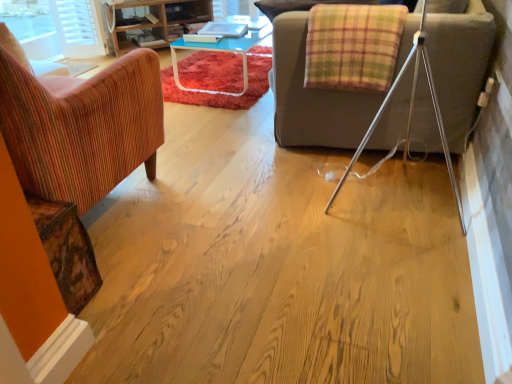
In order to click on wooden shelves at upper left in this screenshot , I will do `click(156, 22)`.

Find the location of a particular element. The height and width of the screenshot is (384, 512). plaid fabric blanket at upper right is located at coordinates (353, 46).

Are plaid fabric blanket at upper right and wooden textured armchair at left beside each other?

No, plaid fabric blanket at upper right is not in contact with wooden textured armchair at left.

Between plaid fabric blanket at upper right and wooden textured armchair at left, which one has smaller size?

With smaller size is plaid fabric blanket at upper right.

Consider the image. From the image's perspective, would you say plaid fabric blanket at upper right is positioned over wooden textured armchair at left?

Yes.

Considering the sizes of objects plaid fabric blanket at upper right and wooden textured armchair at left in the image provided, who is thinner, plaid fabric blanket at upper right or wooden textured armchair at left?

With smaller width is plaid fabric blanket at upper right.

Does wooden shelves at upper left have a lesser width compared to wooden textured armchair at left?

Yes, wooden shelves at upper left is thinner than wooden textured armchair at left.

From a real-world perspective, relative to wooden textured armchair at left, is wooden shelves at upper left vertically above or below?

In terms of real-world spatial position, wooden shelves at upper left is below wooden textured armchair at left.

Between wooden shelves at upper left and wooden textured armchair at left, which one is positioned in front?

wooden textured armchair at left.

Is plaid fabric blanket at upper right looking in the opposite direction of wooden shelves at upper left?

No, plaid fabric blanket at upper right is not facing away from wooden shelves at upper left.

In terms of size, does plaid fabric blanket at upper right appear bigger or smaller than wooden shelves at upper left?

Considering their sizes, plaid fabric blanket at upper right takes up less space than wooden shelves at upper left.

Considering the positions of points (307, 82) and (162, 28), is point (307, 82) farther from camera compared to point (162, 28)?

No.

From a real-world perspective, relative to wooden shelves at upper left, is plaid fabric blanket at upper right vertically above or below?

plaid fabric blanket at upper right is situated higher than wooden shelves at upper left in the real world.

Between wooden textured armchair at left and plaid fabric blanket at upper right, which one is positioned behind?

plaid fabric blanket at upper right.

From a real-world perspective, which object rests below the other?

wooden textured armchair at left, from a real-world perspective.

Is wooden textured armchair at left shorter than plaid fabric blanket at upper right?

No, wooden textured armchair at left is not shorter than plaid fabric blanket at upper right.

From the image's perspective, which is above, wooden textured armchair at left or plaid fabric blanket at upper right?

plaid fabric blanket at upper right.

Which of these two, wooden shelves at upper left or plaid fabric blanket at upper right, is thinner?

Thinner between the two is plaid fabric blanket at upper right.

Is wooden shelves at upper left turned away from plaid fabric blanket at upper right?

No, plaid fabric blanket at upper right is not at the back of wooden shelves at upper left.

In order to click on blanket below the wooden shelves at upper left (from the image's perspective) in this screenshot , I will do `click(353, 46)`.

Looking at this image, how much distance is there between wooden shelves at upper left and plaid fabric blanket at upper right?

wooden shelves at upper left and plaid fabric blanket at upper right are 8.47 feet apart from each other.

Between wooden textured armchair at left and wooden shelves at upper left, which one has more height?

Standing taller between the two is wooden textured armchair at left.

Which is correct: wooden textured armchair at left is inside wooden shelves at upper left, or outside of it?

wooden textured armchair at left is not enclosed by wooden shelves at upper left.

Where is `blanket above the wooden textured armchair at left (from the image's perspective)`? blanket above the wooden textured armchair at left (from the image's perspective) is located at coordinates (353, 46).

The width and height of the screenshot is (512, 384). In order to click on entertainment center on the left side of wooden textured armchair at left in this screenshot , I will do `click(156, 22)`.

When comparing their distances from wooden textured armchair at left, does wooden shelves at upper left or plaid fabric blanket at upper right seem further?

wooden shelves at upper left is further to wooden textured armchair at left.

Estimate the real-world distances between objects in this image. Which object is closer to wooden shelves at upper left, plaid fabric blanket at upper right or wooden textured armchair at left?

plaid fabric blanket at upper right lies closer to wooden shelves at upper left than the other object.

Looking at the image, which one is located further to wooden textured armchair at left, plaid fabric blanket at upper right or wooden shelves at upper left?

wooden shelves at upper left is further to wooden textured armchair at left.

Estimate the real-world distances between objects in this image. Which object is closer to wooden shelves at upper left, wooden textured armchair at left or plaid fabric blanket at upper right?

The object closer to wooden shelves at upper left is plaid fabric blanket at upper right.

Looking at the image, which one is located closer to plaid fabric blanket at upper right, wooden shelves at upper left or wooden textured armchair at left?

wooden textured armchair at left is positioned closer to the anchor plaid fabric blanket at upper right.

Which object lies further to the anchor point plaid fabric blanket at upper right, wooden textured armchair at left or wooden shelves at upper left?

Among the two, wooden shelves at upper left is located further to plaid fabric blanket at upper right.

Where is `blanket positioned between wooden textured armchair at left and wooden shelves at upper left from near to far`? blanket positioned between wooden textured armchair at left and wooden shelves at upper left from near to far is located at coordinates (353, 46).